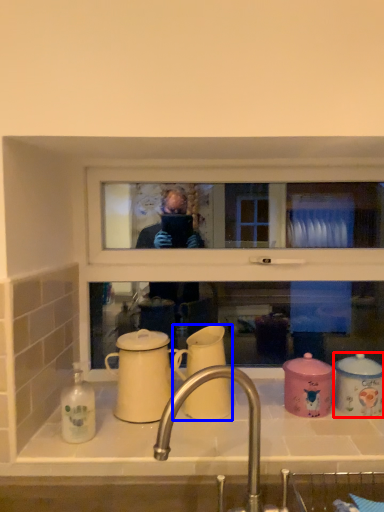
Question: Which of the following is the farthest to the observer, coffee cup (highlighted by a red box) or coffee cup (highlighted by a blue box)?

Choices:
 (A) coffee cup
 (B) coffee cup

Answer: (A)